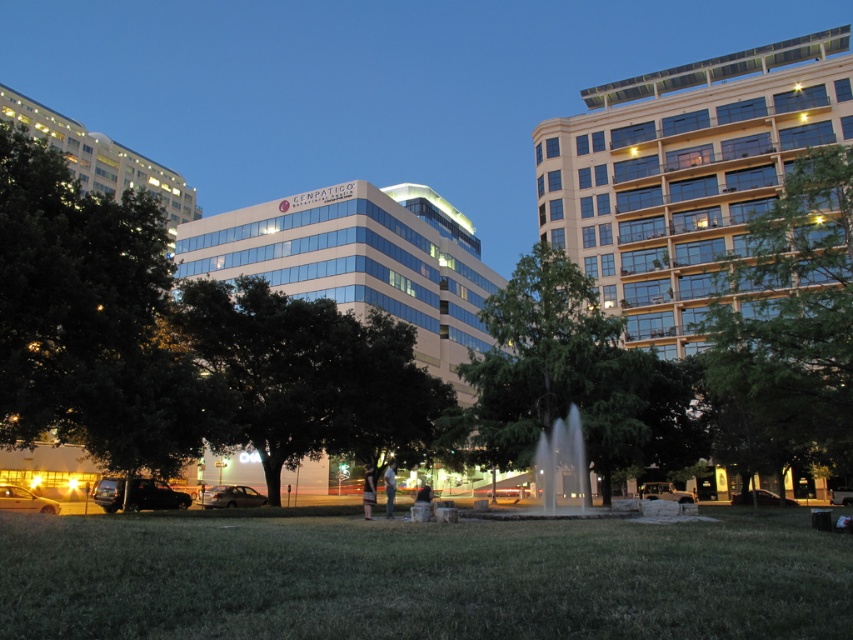
You are standing in the urban park scene at twilight. You see a point labeled as point [683,172]. What does this point indicate?

The point [683,172] marks the gold glass building at upper right.

You are a city planner assessing the park layout. You need to install a new bench between the gold glass building at upper right and the green leafy tree at right. Given that the minimum required distance between any structure and a building is 10 meters, will the bench placement comply with safety regulations?

The distance between the gold glass building at upper right and the green leafy tree at right is 15.15 meters. Since the bench is placed between them, it will be at least 10 meters away from the gold glass building at upper right, thus complying with safety regulations.